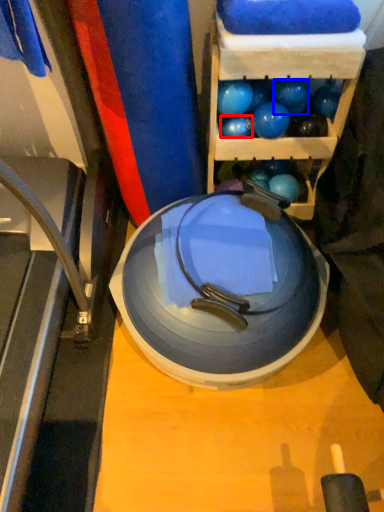
Question: Which object is closer to the camera taking this photo, ball (highlighted by a red box) or ball (highlighted by a blue box)?

Choices:
 (A) ball
 (B) ball

Answer: (B)